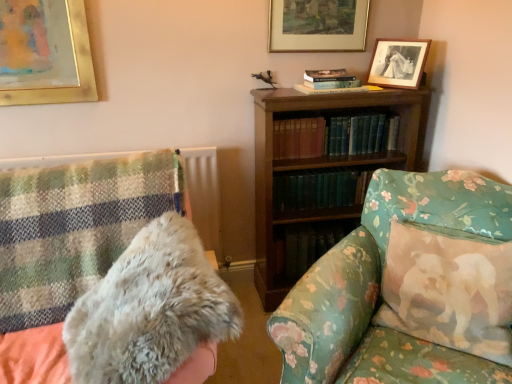
Question: From the image's perspective, is fluffy cotton pillow at right above or below floral fabric couch at center?

Choices:
 (A) below
 (B) above

Answer: (B)

Question: Considering the positions of fluffy cotton pillow at right and floral fabric couch at center in the image, is fluffy cotton pillow at right taller or shorter than floral fabric couch at center?

Choices:
 (A) tall
 (B) short

Answer: (B)

Question: Which object is the closest to the wooden bookcase at center?

Choices:
 (A) floral fabric couch at center
 (B) green leather book at center, which ranks as the 2th book in bottom-to-top order
 (C) fluffy cotton pillow at right
 (D) black matte picture frame at upper right, which ranks as the second picture frame in left-to-right order
 (E) gold-framed picture at upper center, marked as the 1th picture frame in a left-to-right arrangement

Answer: (B)

Question: Which object is the closest to the green hardcover books at center, positioned as the 2th book in top-to-bottom order?

Choices:
 (A) floral fabric couch at center
 (B) green leather book at center, positioned as the first book in top-to-bottom order
 (C) fluffy cotton pillow at right
 (D) black matte picture frame at upper right, placed as the first picture frame when sorted from right to left
 (E) wooden bookcase at center

Answer: (E)